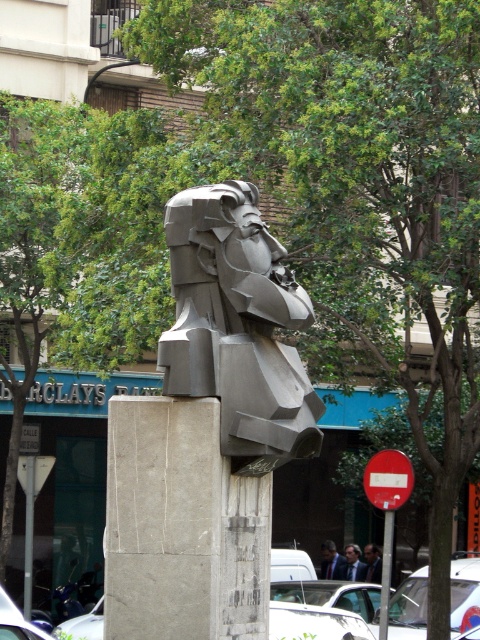
Who is positioned more to the right, dark blue suit at lower center or smooth gray sculpture at center?

Positioned to the right is smooth gray sculpture at center.

Does dark blue suit at lower center have a greater height compared to smooth gray sculpture at center?

Correct, dark blue suit at lower center is much taller as smooth gray sculpture at center.

Find the location of a particular element. The image size is (480, 640). dark blue suit at lower center is located at coordinates (331, 561).

The image size is (480, 640). In order to click on dark blue suit at lower center in this screenshot , I will do `click(331, 561)`.

The width and height of the screenshot is (480, 640). In order to click on dark blue suit at lower center in this screenshot , I will do `click(331, 561)`.

Can you confirm if gray stone bust at center is positioned above dark blue suit at center?

Correct, gray stone bust at center is located above dark blue suit at center.

Is point (170, 365) closer to viewer compared to point (373, 573)?

Yes, point (170, 365) is closer to viewer.

Between point (236, 262) and point (364, 548), which one is positioned behind?

The point (364, 548) is behind.

At what (x,y) coordinates should I click in order to perform the action: click on gray stone bust at center. Please return your answer as a coordinate pair (x, y). The width and height of the screenshot is (480, 640). Looking at the image, I should click on (238, 326).